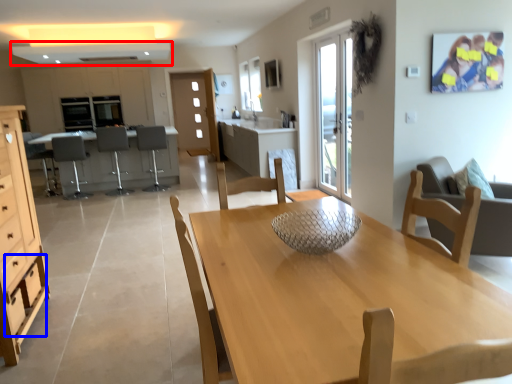
Question: Among these objects, which one is nearest to the camera, exhaust hood (highlighted by a red box) or drawer (highlighted by a blue box)?

Choices:
 (A) exhaust hood
 (B) drawer

Answer: (B)